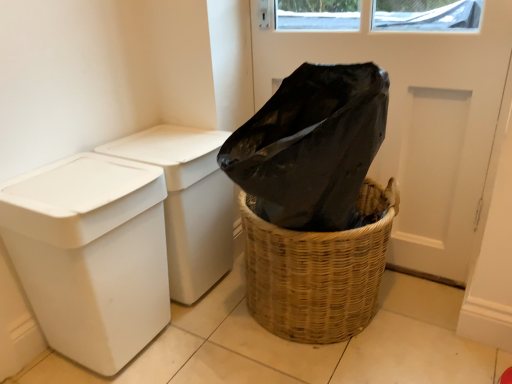
The width and height of the screenshot is (512, 384). What are the coordinates of `empty space that is ontop of white plastic bin at left, which is the 1th waste container in front-to-back order` in the screenshot? It's located at coord(78,181).